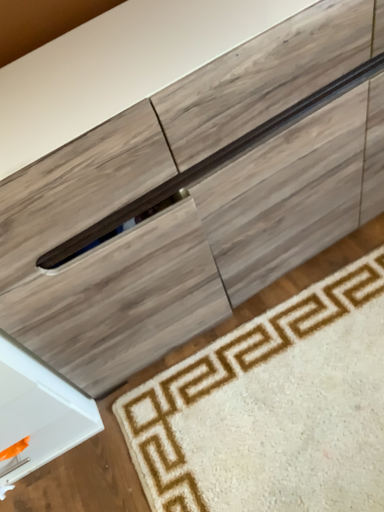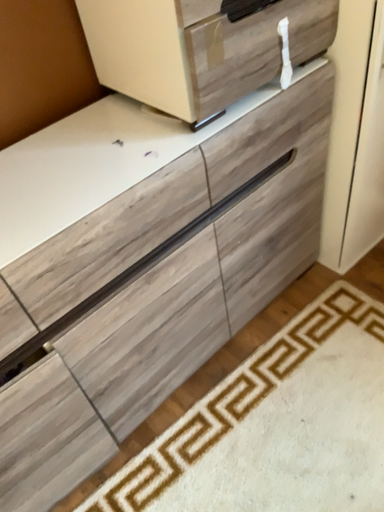
Question: How did the camera likely rotate when shooting the video?

Choices:
 (A) rotated upward
 (B) rotated downward

Answer: (A)